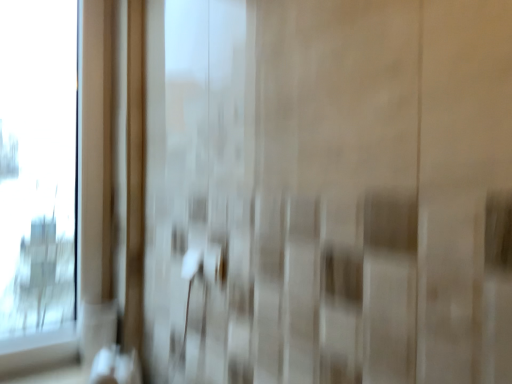
Question: Considering the relative positions of white plastic door handle at center and transparent glass window at left in the image provided, is white plastic door handle at center to the left or to the right of transparent glass window at left?

Choices:
 (A) right
 (B) left

Answer: (A)

Question: Looking at the image, does white plastic door handle at center seem bigger or smaller compared to transparent glass window at left?

Choices:
 (A) big
 (B) small

Answer: (B)

Question: In terms of width, does white plastic door handle at center look wider or thinner when compared to transparent glass window at left?

Choices:
 (A) thin
 (B) wide

Answer: (A)

Question: Is point (6, 210) closer or farther from the camera than point (212, 258)?

Choices:
 (A) farther
 (B) closer

Answer: (A)

Question: Considering the positions of transparent glass window at left and white plastic door handle at center in the image, is transparent glass window at left wider or thinner than white plastic door handle at center?

Choices:
 (A) thin
 (B) wide

Answer: (B)

Question: From the image's perspective, relative to white plastic door handle at center, is transparent glass window at left above or below?

Choices:
 (A) below
 (B) above

Answer: (B)

Question: Is transparent glass window at left in front of or behind white plastic door handle at center in the image?

Choices:
 (A) behind
 (B) front

Answer: (A)